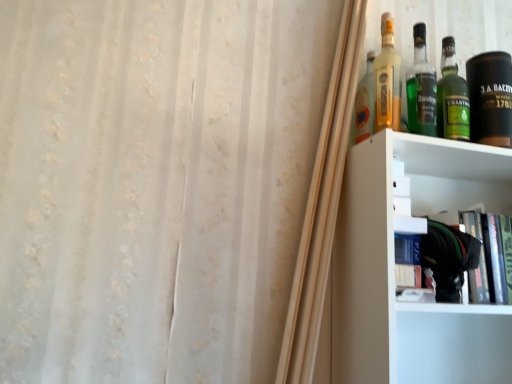
Measure the distance between translucent glass bottle at upper right, the 4th bottle in the right-to-left sequence, and camera.

translucent glass bottle at upper right, the 4th bottle in the right-to-left sequence, and camera are 1.05 meters apart.

In the scene shown: How much space does translucent glass bottle at upper right, the 2th bottle positioned from the left, occupy vertically?

It is 31.12 centimeters.

This screenshot has width=512, height=384. Describe the element at coordinates (490, 98) in the screenshot. I see `black leather canister at upper right` at that location.

In order to face green glass bottle at upper right, the 3th bottle from the left, should I rotate leftwards or rightwards?

A 21.537 degree turn to the right will do.

Image resolution: width=512 pixels, height=384 pixels. I want to click on green glass bottle at upper right, the 3th bottle from the left, so click(x=421, y=88).

Where is `translucent glass bottle at upper right, the 4th bottle in the right-to-left sequence`? The width and height of the screenshot is (512, 384). translucent glass bottle at upper right, the 4th bottle in the right-to-left sequence is located at coordinates (365, 102).

Is green glass bottle at upper right, the 3th bottle from the left, bigger than green glass bottle at upper right, the first bottle viewed from the right?

Actually, green glass bottle at upper right, the 3th bottle from the left, might be smaller than green glass bottle at upper right, the first bottle viewed from the right.

The width and height of the screenshot is (512, 384). Find the location of `the 1st bottle to the left of the green glass bottle at upper right, the first bottle viewed from the right, starting your count from the anchor`. the 1st bottle to the left of the green glass bottle at upper right, the first bottle viewed from the right, starting your count from the anchor is located at coordinates (421, 88).

Is green glass bottle at upper right, the second bottle from the right, in front of green glass bottle at upper right, acting as the 4th bottle starting from the left?

Yes, green glass bottle at upper right, the second bottle from the right, is in front of green glass bottle at upper right, acting as the 4th bottle starting from the left.

Is hardcover book at upper right not within green glass bottle at upper right, acting as the 4th bottle starting from the left?

Yes, hardcover book at upper right is outside of green glass bottle at upper right, acting as the 4th bottle starting from the left.

Based on the photo, which object is positioned more to the right, hardcover book at upper right or green glass bottle at upper right, the first bottle viewed from the right?

Positioned to the right is hardcover book at upper right.

Considering the sizes of hardcover book at upper right and green glass bottle at upper right, acting as the 4th bottle starting from the left, in the image, is hardcover book at upper right wider or thinner than green glass bottle at upper right, acting as the 4th bottle starting from the left,?

In the image, hardcover book at upper right appears to be wider than green glass bottle at upper right, acting as the 4th bottle starting from the left.

From the image's perspective, which object appears higher, hardcover book at upper right or green glass bottle at upper right, acting as the 4th bottle starting from the left?

green glass bottle at upper right, acting as the 4th bottle starting from the left, appears higher in the image.

From the image's perspective, is hardcover book at upper right above or below black leather canister at upper right?

Based on their image positions, hardcover book at upper right is located beneath black leather canister at upper right.

Are hardcover book at upper right and black leather canister at upper right beside each other?

No, hardcover book at upper right is not touching black leather canister at upper right.

Which of these two, translucent glass bottle at upper right, the 4th bottle in the right-to-left sequence, or green glass bottle at upper right, the 3th bottle from the left, stands shorter?

translucent glass bottle at upper right, the 4th bottle in the right-to-left sequence, is shorter.

Find the location of a particular element. Image resolution: width=512 pixels, height=384 pixels. the 2nd bottle to the left when counting from the green glass bottle at upper right, the 3th bottle from the left is located at coordinates (365, 102).

From a real-world perspective, is translucent glass bottle at upper right, the 4th bottle in the right-to-left sequence, positioned under green glass bottle at upper right, the 3th bottle from the left, based on gravity?

Yes, from a real-world perspective, translucent glass bottle at upper right, the 4th bottle in the right-to-left sequence, is beneath green glass bottle at upper right, the 3th bottle from the left.

Is green glass bottle at upper right, the first bottle viewed from the right, facing away from translucent glass bottle at upper right, the 4th bottle in the right-to-left sequence?

green glass bottle at upper right, the first bottle viewed from the right, does not have its back to translucent glass bottle at upper right, the 4th bottle in the right-to-left sequence.

Considering the relative positions of green glass bottle at upper right, the first bottle viewed from the right, and translucent glass bottle at upper right, the 4th bottle in the right-to-left sequence, in the image provided, is green glass bottle at upper right, the first bottle viewed from the right, to the left or to the right of translucent glass bottle at upper right, the 4th bottle in the right-to-left sequence,?

green glass bottle at upper right, the first bottle viewed from the right, is to the right of translucent glass bottle at upper right, the 4th bottle in the right-to-left sequence.

Can you confirm if green glass bottle at upper right, acting as the 4th bottle starting from the left, is taller than translucent glass bottle at upper right, which ranks as the 1th bottle in left-to-right order?

Yes, green glass bottle at upper right, acting as the 4th bottle starting from the left, is taller than translucent glass bottle at upper right, which ranks as the 1th bottle in left-to-right order.

From the image's perspective, relative to translucent glass bottle at upper right, which ranks as the 1th bottle in left-to-right order, is green glass bottle at upper right, acting as the 4th bottle starting from the left, above or below?

Based on their image positions, green glass bottle at upper right, acting as the 4th bottle starting from the left, is located above translucent glass bottle at upper right, which ranks as the 1th bottle in left-to-right order.

Is green glass bottle at upper right, acting as the 4th bottle starting from the left, far away from translucent glass bottle at upper right, the 2th bottle positioned from the left?

green glass bottle at upper right, acting as the 4th bottle starting from the left, is near translucent glass bottle at upper right, the 2th bottle positioned from the left, not far away.

Is green glass bottle at upper right, the first bottle viewed from the right, in front of or behind translucent glass bottle at upper right, marked as the 3th bottle in a right-to-left arrangement, in the image?

green glass bottle at upper right, the first bottle viewed from the right, is behind translucent glass bottle at upper right, marked as the 3th bottle in a right-to-left arrangement.

From the image's perspective, is green glass bottle at upper right, the first bottle viewed from the right, located above or below translucent glass bottle at upper right, the 2th bottle positioned from the left?

Based on their image positions, green glass bottle at upper right, the first bottle viewed from the right, is located beneath translucent glass bottle at upper right, the 2th bottle positioned from the left.

Considering the positions of objects green glass bottle at upper right, acting as the 4th bottle starting from the left, and translucent glass bottle at upper right, the 2th bottle positioned from the left, in the image provided, who is more to the right, green glass bottle at upper right, acting as the 4th bottle starting from the left, or translucent glass bottle at upper right, the 2th bottle positioned from the left,?

Positioned to the right is green glass bottle at upper right, acting as the 4th bottle starting from the left.

Based on the photo, who is more distant, translucent glass bottle at upper right, which ranks as the 1th bottle in left-to-right order, or hardcover book at upper right?

translucent glass bottle at upper right, which ranks as the 1th bottle in left-to-right order, is further from the camera.

Considering the sizes of objects translucent glass bottle at upper right, which ranks as the 1th bottle in left-to-right order, and hardcover book at upper right in the image provided, who is bigger, translucent glass bottle at upper right, which ranks as the 1th bottle in left-to-right order, or hardcover book at upper right?

With larger size is hardcover book at upper right.

Based on the photo, are translucent glass bottle at upper right, which ranks as the 1th bottle in left-to-right order, and hardcover book at upper right far apart?

No, translucent glass bottle at upper right, which ranks as the 1th bottle in left-to-right order, is not far away from hardcover book at upper right.

Locate an element on the screen. The width and height of the screenshot is (512, 384). the 1st bottle behind the green glass bottle at upper right, the second bottle from the right, starting your count from the anchor is located at coordinates (452, 97).

Where is `book beneath the green glass bottle at upper right, the first bottle viewed from the right (from a real-world perspective)`? book beneath the green glass bottle at upper right, the first bottle viewed from the right (from a real-world perspective) is located at coordinates (470, 257).

Based on their spatial positions, is translucent glass bottle at upper right, which ranks as the 1th bottle in left-to-right order, or green glass bottle at upper right, the first bottle viewed from the right, closer to translucent glass bottle at upper right, the 2th bottle positioned from the left?

translucent glass bottle at upper right, which ranks as the 1th bottle in left-to-right order, is closer to translucent glass bottle at upper right, the 2th bottle positioned from the left.

Based on their spatial positions, is translucent glass bottle at upper right, marked as the 3th bottle in a right-to-left arrangement, or hardcover book at upper right closer to translucent glass bottle at upper right, which ranks as the 1th bottle in left-to-right order?

translucent glass bottle at upper right, marked as the 3th bottle in a right-to-left arrangement, is closer to translucent glass bottle at upper right, which ranks as the 1th bottle in left-to-right order.

When comparing their distances from black leather canister at upper right, does translucent glass bottle at upper right, marked as the 3th bottle in a right-to-left arrangement, or green glass bottle at upper right, the second bottle from the right, seem further?

Based on the image, translucent glass bottle at upper right, marked as the 3th bottle in a right-to-left arrangement, appears to be further to black leather canister at upper right.

Based on their spatial positions, is green glass bottle at upper right, the 3th bottle from the left, or translucent glass bottle at upper right, marked as the 3th bottle in a right-to-left arrangement, further from green glass bottle at upper right, acting as the 4th bottle starting from the left?

Based on the image, translucent glass bottle at upper right, marked as the 3th bottle in a right-to-left arrangement, appears to be further to green glass bottle at upper right, acting as the 4th bottle starting from the left.

Based on their spatial positions, is hardcover book at upper right or green glass bottle at upper right, the 3th bottle from the left, further from black leather canister at upper right?

hardcover book at upper right.

Looking at the image, which one is located further to black leather canister at upper right, translucent glass bottle at upper right, which ranks as the 1th bottle in left-to-right order, or green glass bottle at upper right, the first bottle viewed from the right?

Among the two, translucent glass bottle at upper right, which ranks as the 1th bottle in left-to-right order, is located further to black leather canister at upper right.

Based on their spatial positions, is hardcover book at upper right or translucent glass bottle at upper right, the 2th bottle positioned from the left, further from translucent glass bottle at upper right, the 4th bottle in the right-to-left sequence?

hardcover book at upper right is positioned further to the anchor translucent glass bottle at upper right, the 4th bottle in the right-to-left sequence.

Looking at the image, which one is located further to green glass bottle at upper right, the 3th bottle from the left, hardcover book at upper right or translucent glass bottle at upper right, the 4th bottle in the right-to-left sequence?

Based on the image, hardcover book at upper right appears to be further to green glass bottle at upper right, the 3th bottle from the left.

Locate an element on the screen. This screenshot has height=384, width=512. beverage between translucent glass bottle at upper right, the 2th bottle positioned from the left, and hardcover book at upper right, in the vertical direction is located at coordinates (490, 98).

Locate an element on the screen. Image resolution: width=512 pixels, height=384 pixels. beverage between green glass bottle at upper right, the first bottle viewed from the right, and hardcover book at upper right in the up-down direction is located at coordinates (490, 98).

Where is `bottle situated between translucent glass bottle at upper right, which ranks as the 1th bottle in left-to-right order, and green glass bottle at upper right, the second bottle from the right, from left to right`? The height and width of the screenshot is (384, 512). bottle situated between translucent glass bottle at upper right, which ranks as the 1th bottle in left-to-right order, and green glass bottle at upper right, the second bottle from the right, from left to right is located at coordinates (387, 79).

Identify the location of bottle located between green glass bottle at upper right, the second bottle from the right, and black leather canister at upper right in the left-right direction. (452, 97).